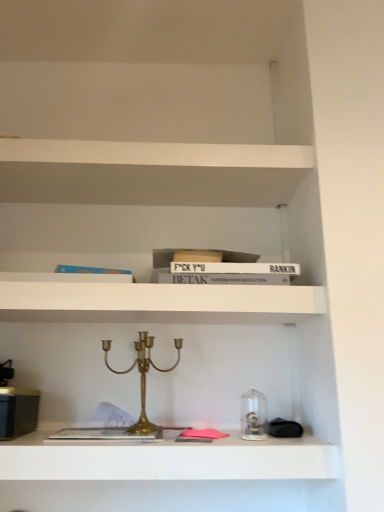
Question: From a real-world perspective, is white matte bookshelf at upper center, which appears as the 2th shelf when ordered from the bottom, positioned above or below gold brass candle holder at center?

Choices:
 (A) above
 (B) below

Answer: (A)

Question: Does point (36, 292) appear closer or farther from the camera than point (148, 364)?

Choices:
 (A) farther
 (B) closer

Answer: (B)

Question: Which object is positioned closest to the metallic gold candelabra at center, which is counted as the second shelf, starting from the top?

Choices:
 (A) gold brass candle holder at center
 (B) white matte bookshelf at upper center, arranged as the 1th shelf when viewed from the top

Answer: (A)

Question: Estimate the real-world distances between objects in this image. Which object is closer to the white matte bookshelf at upper center, arranged as the 1th shelf when viewed from the top?

Choices:
 (A) metallic gold candelabra at center, the 1th shelf ordered from the bottom
 (B) gold brass candle holder at center

Answer: (B)